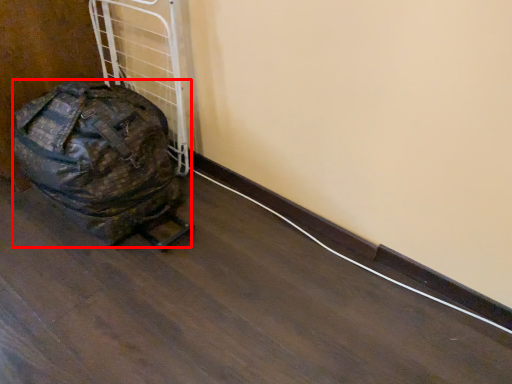
Question: From the image, what is the correct spatial relationship of luggage and bags (annotated by the red box) in relation to wire?

Choices:
 (A) right
 (B) left

Answer: (B)